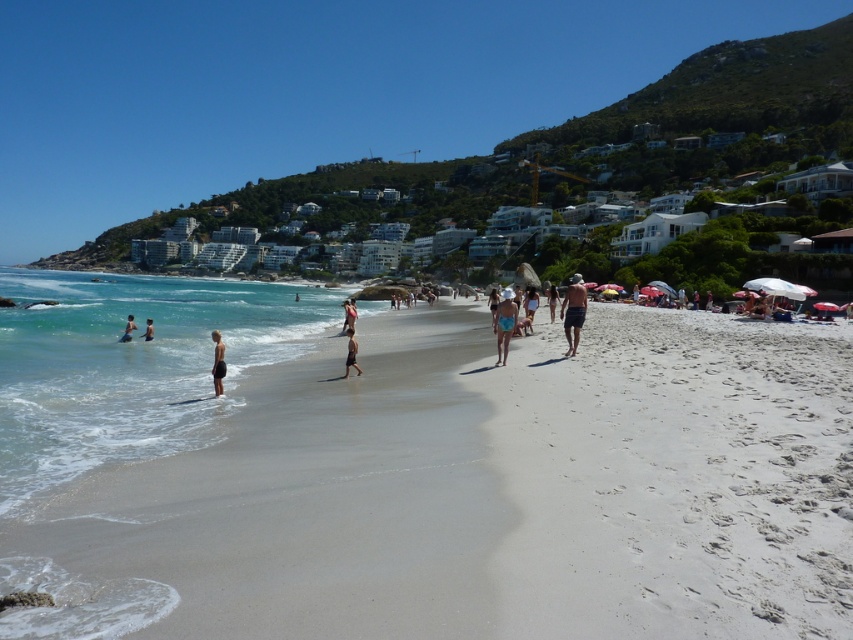
In order to click on dark gray shorts at center in this screenshot , I will do click(351, 353).

Can you confirm if dark gray shorts at center is positioned below light blue swimwear at left?

Yes, dark gray shorts at center is below light blue swimwear at left.

Describe the element at coordinates (351, 353) in the screenshot. I see `dark gray shorts at center` at that location.

I want to click on dark gray shorts at center, so click(x=351, y=353).

Can you confirm if tan fabric shorts at center is positioned to the left of light brown skin at left?

No, tan fabric shorts at center is not to the left of light brown skin at left.

Is point (576, 298) farther from camera compared to point (131, 332)?

That is False.

Where is `tan fabric shorts at center`? The image size is (853, 640). tan fabric shorts at center is located at coordinates (573, 312).

Who is positioned more to the left, matte black shorts at center or light brown skin at left?

From the viewer's perspective, light brown skin at left appears more on the left side.

What do you see at coordinates (218, 362) in the screenshot? I see `matte black shorts at center` at bounding box center [218, 362].

The image size is (853, 640). Identify the location of matte black shorts at center. (218, 362).